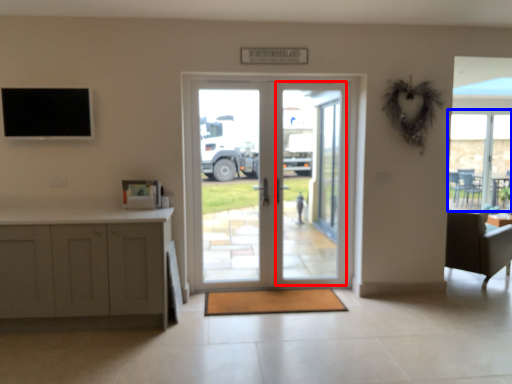
Question: Which object is further to the camera taking this photo, screen door (highlighted by a red box) or window (highlighted by a blue box)?

Choices:
 (A) screen door
 (B) window

Answer: (B)